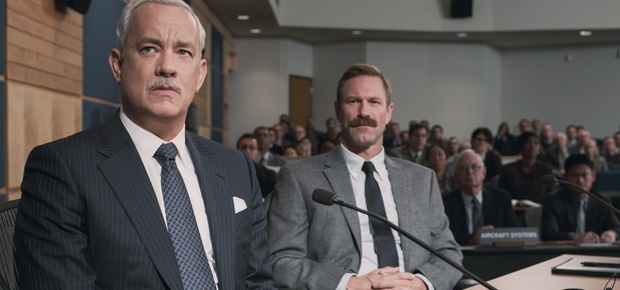
I want to click on ceiling, so click(326, 15).